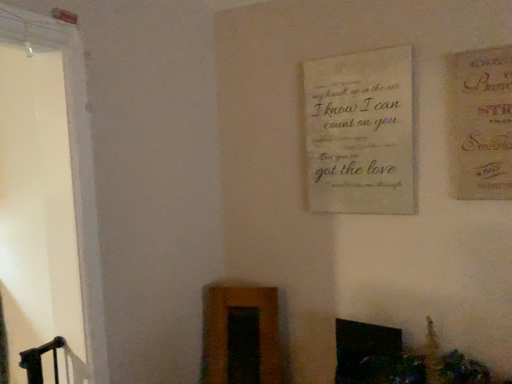
Based on the photo, in order to face black glossy fireplace at lower center, should I rotate leftwards or rightwards?

You should rotate right by 14.527 degrees.

What is the approximate height of off-white fabric plaque at center?

25.36 inches.

Where is `matte beige postcard at upper right`? matte beige postcard at upper right is located at coordinates (480, 123).

Between off-white fabric plaque at center and black glossy fireplace at lower center, which one has less height?

black glossy fireplace at lower center.

From the image's perspective, relative to black glossy fireplace at lower center, is off-white fabric plaque at center above or below?

Based on their image positions, off-white fabric plaque at center is located above black glossy fireplace at lower center.

From a real-world perspective, who is located higher, off-white fabric plaque at center or black glossy fireplace at lower center?

off-white fabric plaque at center is physically above.

In the scene shown: Is black glossy fireplace at lower center at the back of off-white fabric plaque at center?

off-white fabric plaque at center does not have its back to black glossy fireplace at lower center.

Does point (497, 176) lie in front of point (377, 205)?

Yes, point (497, 176) is in front of point (377, 205).

In the scene shown: Can you tell me how much matte beige postcard at upper right and off-white fabric plaque at center differ in facing direction?

The angular difference between matte beige postcard at upper right and off-white fabric plaque at center is 0.371 degrees.

From a real-world perspective, is matte beige postcard at upper right physically located above or below off-white fabric plaque at center?

From a real-world perspective, matte beige postcard at upper right is physically above off-white fabric plaque at center.

Is matte beige postcard at upper right aimed at off-white fabric plaque at center?

No, matte beige postcard at upper right does not turn towards off-white fabric plaque at center.

The height and width of the screenshot is (384, 512). What are the coordinates of `postcard that appears on the right of black glossy fireplace at lower center` in the screenshot? It's located at (480, 123).

Can you tell me how much black glossy fireplace at lower center and matte beige postcard at upper right differ in facing direction?

black glossy fireplace at lower center and matte beige postcard at upper right are facing 0.455 degrees away from each other.

How distant is black glossy fireplace at lower center from matte beige postcard at upper right?

29.82 inches.

Is black glossy fireplace at lower center taller or shorter than matte beige postcard at upper right?

In the image, black glossy fireplace at lower center appears to be shorter than matte beige postcard at upper right.

Between matte beige postcard at upper right and black glossy fireplace at lower center, which one is positioned behind?

black glossy fireplace at lower center is further from the camera.

From a real-world perspective, who is located higher, matte beige postcard at upper right or black glossy fireplace at lower center?

matte beige postcard at upper right is physically above.

Does matte beige postcard at upper right have a lesser height compared to black glossy fireplace at lower center?

No, matte beige postcard at upper right is not shorter than black glossy fireplace at lower center.

How different are the orientations of matte beige postcard at upper right and black glossy fireplace at lower center in degrees?

The angle between the facing direction of matte beige postcard at upper right and the facing direction of black glossy fireplace at lower center is 0.455 degrees.

How different are the orientations of black glossy fireplace at lower center and off-white fabric plaque at center in degrees?

There is a 0.826-degree angle between the facing directions of black glossy fireplace at lower center and off-white fabric plaque at center.

From a real-world perspective, who is located lower, black glossy fireplace at lower center or off-white fabric plaque at center?

black glossy fireplace at lower center.

Is black glossy fireplace at lower center far from off-white fabric plaque at center?

black glossy fireplace at lower center is actually quite close to off-white fabric plaque at center.

How distant is black glossy fireplace at lower center from off-white fabric plaque at center?

black glossy fireplace at lower center is 26.46 inches away from off-white fabric plaque at center.

Which is behind, off-white fabric plaque at center or matte beige postcard at upper right?

off-white fabric plaque at center is further away from the camera.

Is off-white fabric plaque at center oriented towards matte beige postcard at upper right?

No.

Is off-white fabric plaque at center placed right next to matte beige postcard at upper right?

No, off-white fabric plaque at center is not with matte beige postcard at upper right.

Is off-white fabric plaque at center bigger or smaller than matte beige postcard at upper right?

In the image, off-white fabric plaque at center appears to be larger than matte beige postcard at upper right.

This screenshot has height=384, width=512. Find the location of `fireplace directly beneath the off-white fabric plaque at center (from a real-world perspective)`. fireplace directly beneath the off-white fabric plaque at center (from a real-world perspective) is located at coordinates (362, 349).

Image resolution: width=512 pixels, height=384 pixels. I want to click on postcard to the right of off-white fabric plaque at center, so click(480, 123).

When comparing their distances from off-white fabric plaque at center, does matte beige postcard at upper right or black glossy fireplace at lower center seem further?

Based on the image, black glossy fireplace at lower center appears to be further to off-white fabric plaque at center.

Considering their positions, is matte beige postcard at upper right positioned further to black glossy fireplace at lower center than off-white fabric plaque at center?

matte beige postcard at upper right is further to black glossy fireplace at lower center.

Looking at the image, which one is located further to off-white fabric plaque at center, black glossy fireplace at lower center or matte beige postcard at upper right?

black glossy fireplace at lower center.

Considering their positions, is black glossy fireplace at lower center positioned closer to matte beige postcard at upper right than off-white fabric plaque at center?

off-white fabric plaque at center lies closer to matte beige postcard at upper right than the other object.

When comparing their distances from black glossy fireplace at lower center, does off-white fabric plaque at center or matte beige postcard at upper right seem closer?

The object closer to black glossy fireplace at lower center is off-white fabric plaque at center.

Which object lies nearer to the anchor point matte beige postcard at upper right, off-white fabric plaque at center or black glossy fireplace at lower center?

Among the two, off-white fabric plaque at center is located nearer to matte beige postcard at upper right.

The image size is (512, 384). I want to click on plaque between matte beige postcard at upper right and black glossy fireplace at lower center in the up-down direction, so click(x=360, y=132).